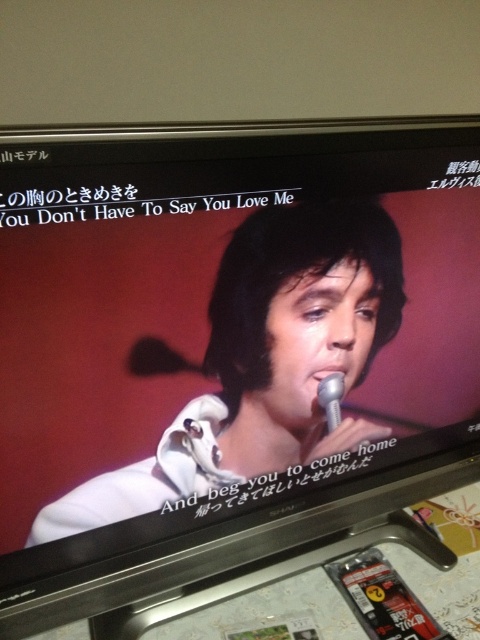
Question: Is white matte jacket at center above metallic silver microphone at center?

Choices:
 (A) yes
 (B) no

Answer: (A)

Question: Does white matte jacket at center appear on the left side of metallic silver microphone at center?

Choices:
 (A) yes
 (B) no

Answer: (A)

Question: Which object is farther from the camera taking this photo?

Choices:
 (A) white matte jacket at center
 (B) metallic silver microphone at center

Answer: (B)

Question: Does white matte jacket at center lie behind metallic silver microphone at center?

Choices:
 (A) yes
 (B) no

Answer: (B)